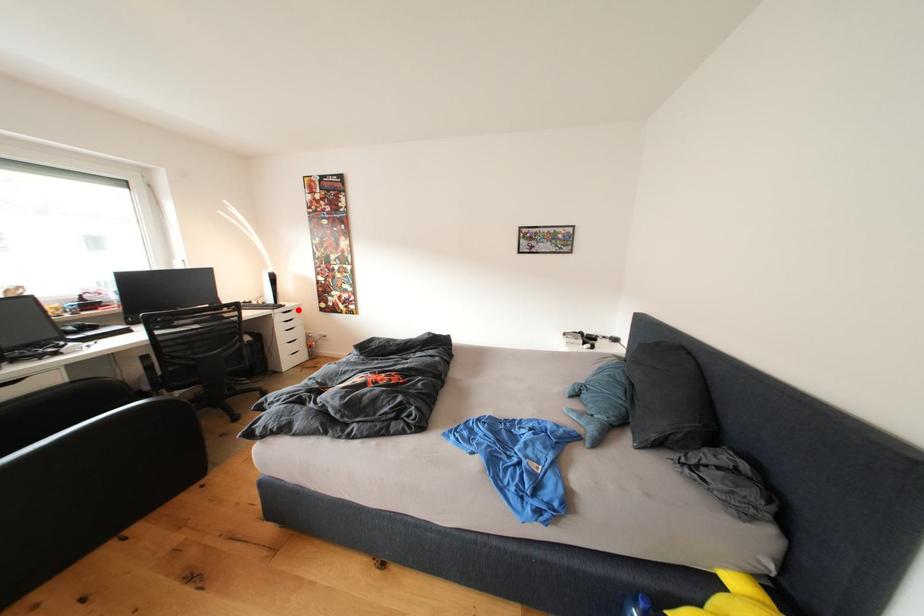
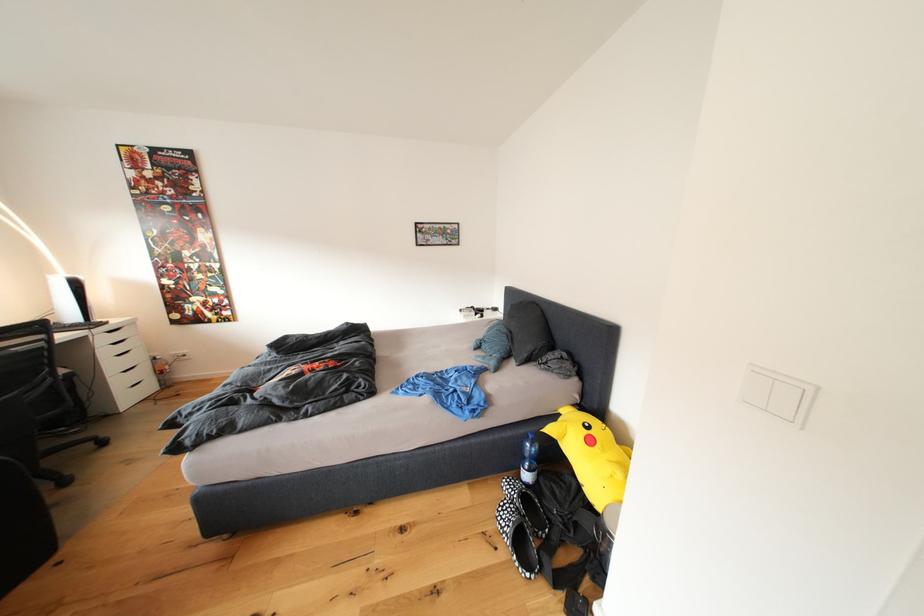
The point at the highlighted location is marked in the first image. Where is the corresponding point in the second image?

(125, 326)